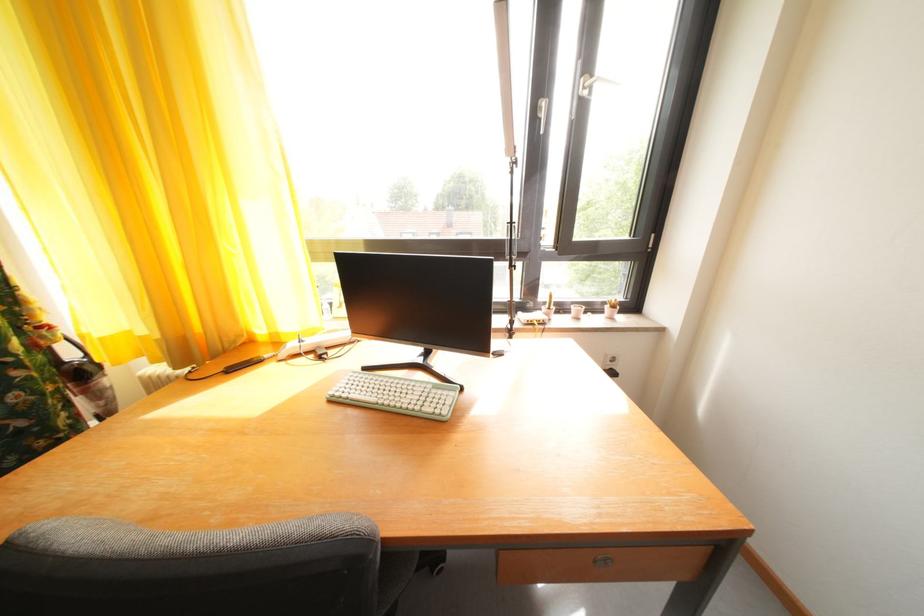
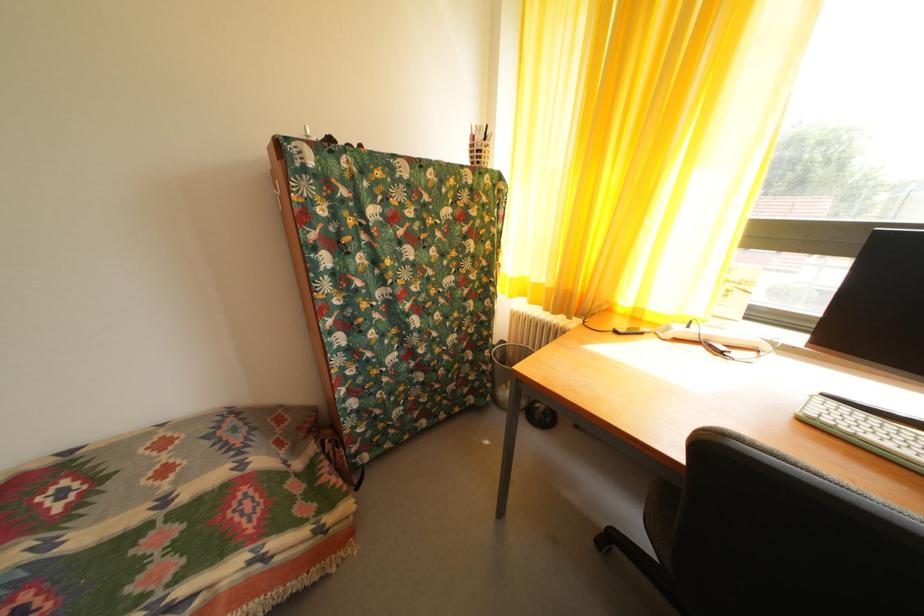
Question: The images are taken continuously from a first-person perspective. In which direction is your viewpoint rotating?

Choices:
 (A) Left
 (B) Right
 (C) Up
 (D) Down

Answer: (A)